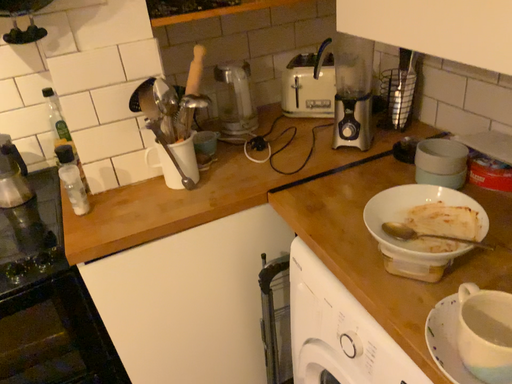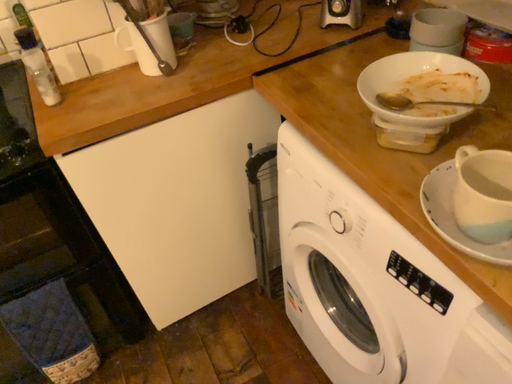
Question: Which way did the camera rotate in the video?

Choices:
 (A) rotated downward
 (B) rotated upward

Answer: (A)